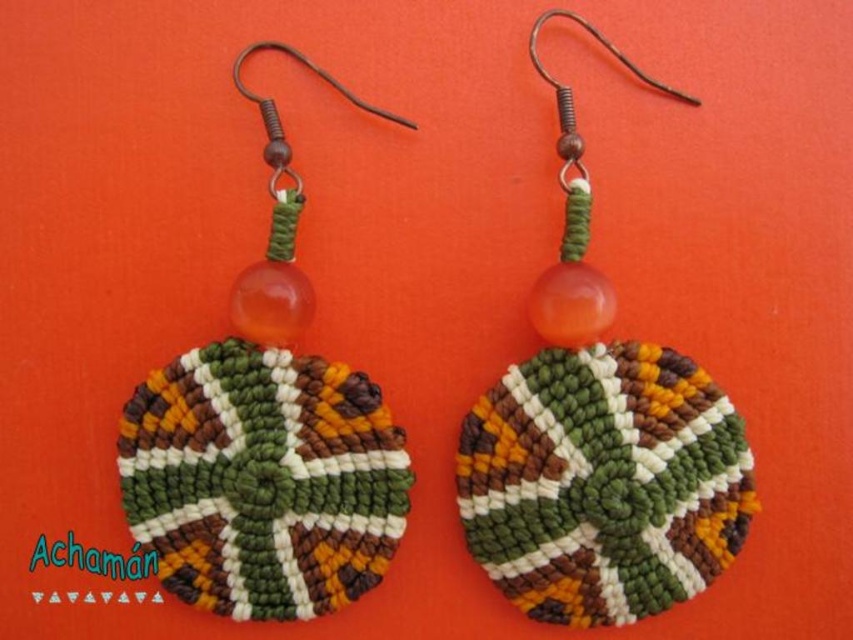
Question: Does multicolored woven disc at center appear on the left side of matte woven disc at center?

Choices:
 (A) yes
 (B) no

Answer: (B)

Question: Does multicolored woven disc at center appear under matte woven disc at center?

Choices:
 (A) no
 (B) yes

Answer: (A)

Question: Among these points, which one is farthest from the camera?

Choices:
 (A) (553, 323)
 (B) (131, 416)

Answer: (A)

Question: Where is multicolored woven disc at center located in relation to matte woven disc at center in the image?

Choices:
 (A) right
 (B) left

Answer: (A)